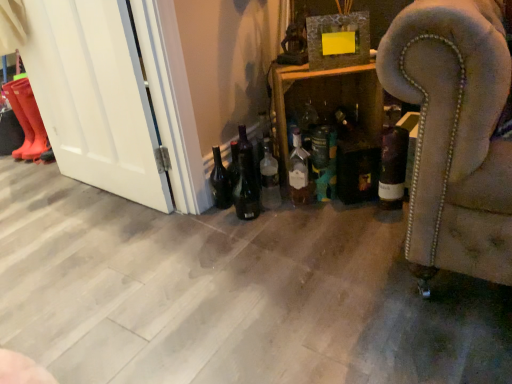
Locate an element on the screen. The height and width of the screenshot is (384, 512). vacant region in front of rubber boots at left, which is the 1th boot from right to left is located at coordinates click(x=24, y=163).